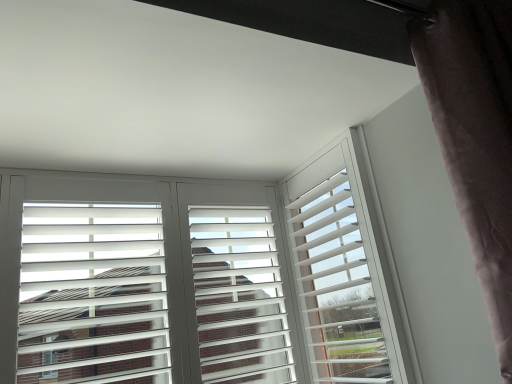
Question: Considering the positions of white matte window frame at center and white matte shutters at center in the image, is white matte window frame at center bigger or smaller than white matte shutters at center?

Choices:
 (A) big
 (B) small

Answer: (B)

Question: Considering the positions of point (336, 165) and point (312, 218), is point (336, 165) closer or farther from the camera than point (312, 218)?

Choices:
 (A) closer
 (B) farther

Answer: (A)

Question: Which object is positioned farthest from the white matte shutters at center?

Choices:
 (A) dark velvet curtain at right
 (B) white matte window frame at center

Answer: (A)

Question: Which object is positioned farthest from the dark velvet curtain at right?

Choices:
 (A) white matte window frame at center
 (B) white matte shutters at center

Answer: (B)